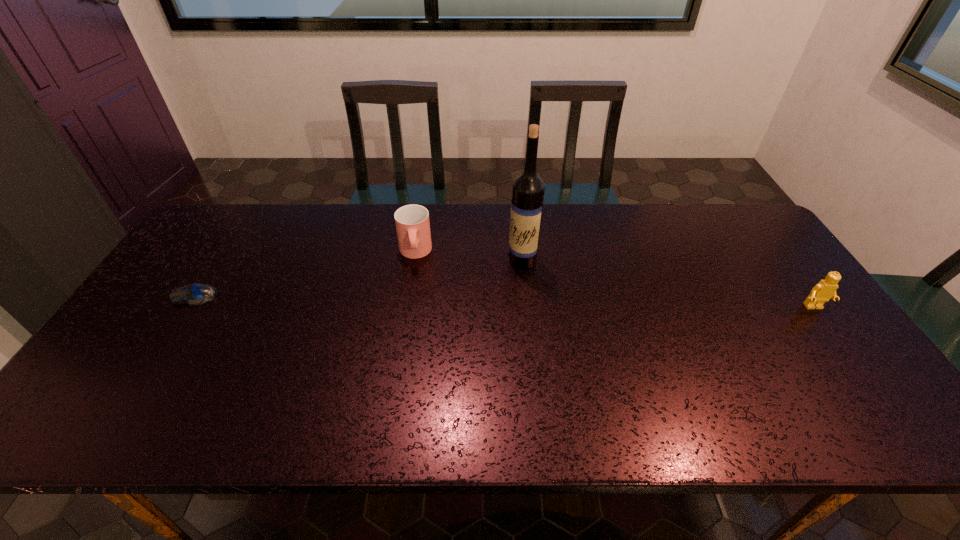
Find the location of a particular element. This screenshot has height=540, width=960. the shortest object is located at coordinates (196, 294).

The width and height of the screenshot is (960, 540). In order to click on the leftmost object in this screenshot , I will do `click(196, 294)`.

Find the location of a particular element. Lego is located at coordinates (826, 289).

Where is `the second object from left to right`? This screenshot has width=960, height=540. the second object from left to right is located at coordinates (412, 222).

Identify the location of the second object from right to left. This screenshot has width=960, height=540. (528, 190).

You are a GUI agent. You are given a task and a screenshot of the screen. Output one action in this format:
    pyautogui.click(x=<x>, y=<y>)
    Task: Click on the wine bottle
    
    Given the screenshot: What is the action you would take?
    pos(528,190)

Identify the location of free space located on the face of the Lego. (877, 395).

Where is `free location located 0.390m on the side of the second object from left to right with the handle`? Image resolution: width=960 pixels, height=540 pixels. free location located 0.390m on the side of the second object from left to right with the handle is located at coordinates (417, 381).

Identify the location of vacant space located on the side of the second object from left to right with the handle. The image size is (960, 540). (415, 285).

Locate an element on the screen. The height and width of the screenshot is (540, 960). free space located on the side of the second object from left to right with the handle is located at coordinates pos(417,381).